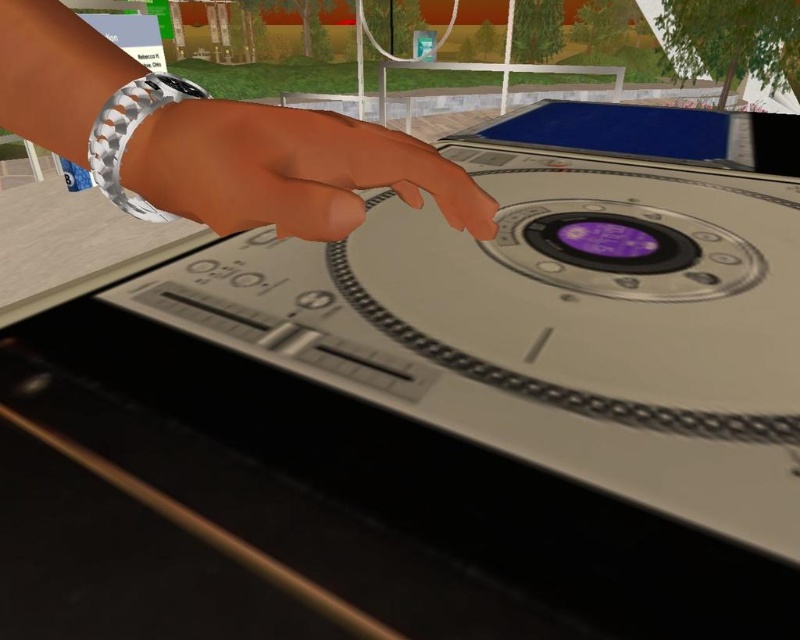
Question: Which object appears farthest from the camera in this image?

Choices:
 (A) satin silver wristwatch at center
 (B) silver metallic watch at upper left

Answer: (A)

Question: Is silver metallic watch at upper left thinner than satin silver wristwatch at center?

Choices:
 (A) no
 (B) yes

Answer: (A)

Question: Which object appears closest to the camera in this image?

Choices:
 (A) silver metallic watch at upper left
 (B) satin silver wristwatch at center

Answer: (A)

Question: Does silver metallic watch at upper left have a smaller size compared to satin silver wristwatch at center?

Choices:
 (A) yes
 (B) no

Answer: (B)

Question: Can you confirm if silver metallic watch at upper left is thinner than satin silver wristwatch at center?

Choices:
 (A) yes
 (B) no

Answer: (B)

Question: Which point is closer to the camera?

Choices:
 (A) satin silver wristwatch at center
 (B) silver metallic watch at upper left

Answer: (B)